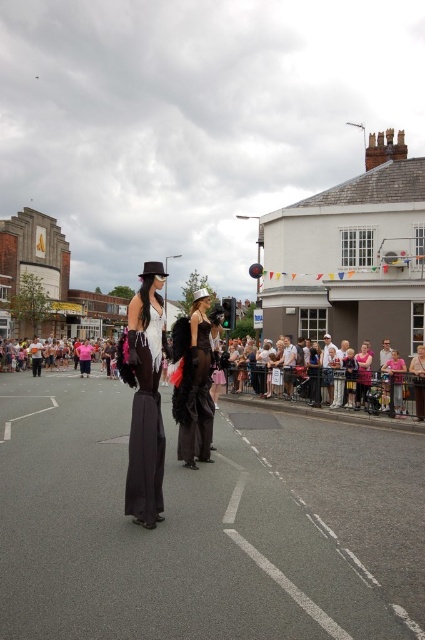
Question: Is pink fabric crowd at center thinner than matte black dress at center?

Choices:
 (A) yes
 (B) no

Answer: (B)

Question: Can you confirm if pink fabric crowd at center is positioned to the right of matte black dress at center?

Choices:
 (A) no
 (B) yes

Answer: (A)

Question: Is pink fabric crowd at center positioned behind black satin dress at center?

Choices:
 (A) yes
 (B) no

Answer: (B)

Question: Which object is farther from the camera taking this photo?

Choices:
 (A) matte black dress at center
 (B) black satin dress at center

Answer: (B)

Question: Estimate the real-world distances between objects in this image. Which object is farther from the black satin dress at center?

Choices:
 (A) matte black dress at center
 (B) pink fabric crowd at center

Answer: (B)

Question: Which object is the farthest from the pink fabric crowd at center?

Choices:
 (A) matte black dress at center
 (B) black satin dress at center

Answer: (A)